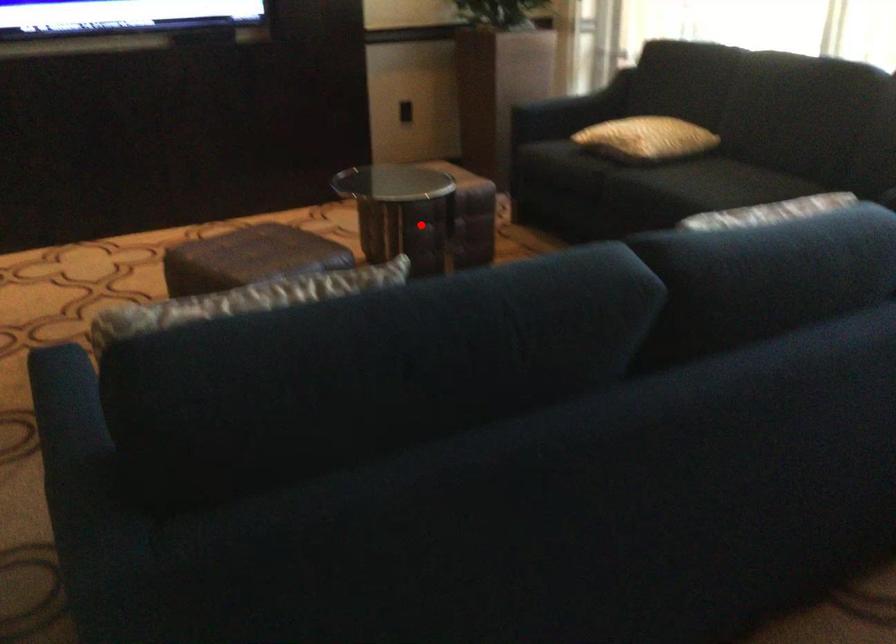
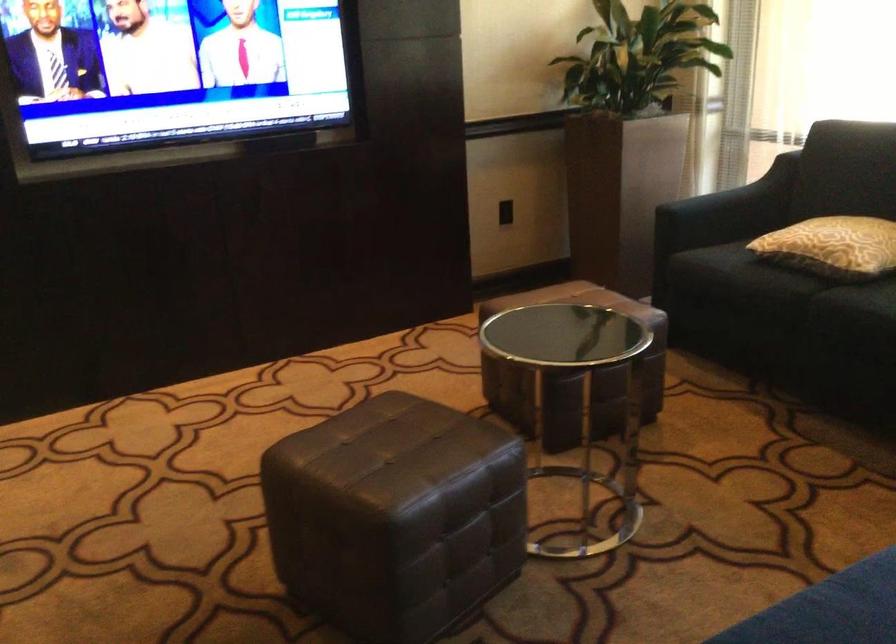
Question: I am providing you with two images of the same scene from different viewpoints. A red point is marked on the first image. Is the red point's position out of view in image 2?

Choices:
 (A) Yes
 (B) No

Answer: (B)